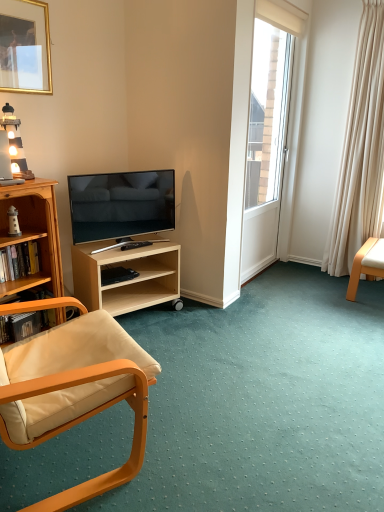
What do you see at coordinates (121, 204) in the screenshot? The height and width of the screenshot is (512, 384). I see `matte black tv at center left` at bounding box center [121, 204].

I want to click on white leather chair at right, which ranks as the second chair in front-to-back order, so click(x=366, y=265).

In order to face matte wood chair at left, which ranks as the 1th chair in left-to-right order, should I rotate leftwards or rightwards?

A 17.034 degree turn to the left will do.

What do you see at coordinates (75, 388) in the screenshot? I see `matte wood chair at left, the 2th chair in the back-to-front sequence` at bounding box center [75, 388].

You are a GUI agent. You are given a task and a screenshot of the screen. Output one action in this format:
    pyautogui.click(x=<x>, y=<y>)
    Task: Click on the matte black tv at center left
    Image resolution: width=384 pixels, height=512 pixels.
    Given the screenshot: What is the action you would take?
    pyautogui.click(x=121, y=204)

Image resolution: width=384 pixels, height=512 pixels. I want to click on the 1st shelf counting from the left of the black plastic remote control at lower center, so click(128, 280).

Relative to black plastic remote control at lower center, is light wood/finishedobject at center, the first shelf when ordered from right to left, in front or behind?

Clearly, light wood/finishedobject at center, the first shelf when ordered from right to left, is in front of black plastic remote control at lower center.

Does light wood/finishedobject at center, marked as the 2th shelf in a left-to-right arrangement, contain black plastic remote control at lower center?

Yes, black plastic remote control at lower center can be found within light wood/finishedobject at center, marked as the 2th shelf in a left-to-right arrangement.

Which object is thinner, light wood/finishedobject at center, marked as the 2th shelf in a left-to-right arrangement, or black plastic remote control at lower center?

black plastic remote control at lower center.

Is white glossy door at upper right at the right side of wooden bookshelf at left?

Yes, white glossy door at upper right is to the right of wooden bookshelf at left.

Consider the image. Which object is further away from the camera, white glossy door at upper right or wooden bookshelf at left?

white glossy door at upper right.

Between white glossy door at upper right and wooden bookshelf at left, which one has smaller size?

Smaller between the two is wooden bookshelf at left.

Measure the distance between white glossy door at upper right and wooden bookshelf at left.

They are 6.07 feet apart.

Does white leather chair at right, marked as the first chair in a right-to-left arrangement, have a greater height compared to wooden bookshelf at lower left, positioned as the 2th shelf in right-to-left order?

Yes.

From a real-world perspective, between white leather chair at right, marked as the first chair in a right-to-left arrangement, and wooden bookshelf at lower left, positioned as the 2th shelf in right-to-left order, who is vertically lower?

wooden bookshelf at lower left, positioned as the 2th shelf in right-to-left order, is physically lower.

Looking at this image, from the image's perspective, relative to wooden bookshelf at lower left, positioned as the 2th shelf in right-to-left order, is white leather chair at right, the second chair viewed from the left, above or below?

white leather chair at right, the second chair viewed from the left, is above wooden bookshelf at lower left, positioned as the 2th shelf in right-to-left order.

Is gold metallic picture frame at upper left further to camera compared to matte black tv at center left?

No.

Is gold metallic picture frame at upper left not inside matte black tv at center left?

Indeed, gold metallic picture frame at upper left is completely outside matte black tv at center left.

Considering the sizes of objects gold metallic picture frame at upper left and matte black tv at center left in the image provided, who is shorter, gold metallic picture frame at upper left or matte black tv at center left?

Standing shorter between the two is matte black tv at center left.

Is gold metallic picture frame at upper left oriented away from matte black tv at center left?

No.

Does gold metallic picture frame at upper left touch wooden bookshelf at lower left, positioned as the 2th shelf in right-to-left order?

gold metallic picture frame at upper left and wooden bookshelf at lower left, positioned as the 2th shelf in right-to-left order, are not in contact.

Do you think gold metallic picture frame at upper left is within wooden bookshelf at lower left, acting as the 1th shelf starting from the left, or outside of it?

gold metallic picture frame at upper left is not inside wooden bookshelf at lower left, acting as the 1th shelf starting from the left, it's outside.

Does gold metallic picture frame at upper left have a lesser width compared to wooden bookshelf at lower left, acting as the 1th shelf starting from the left?

Correct, the width of gold metallic picture frame at upper left is less than that of wooden bookshelf at lower left, acting as the 1th shelf starting from the left.

From the image's perspective, between hardcover book at left and gold metallic picture frame at upper left, who is located below?

hardcover book at left appears lower in the image.

Where is `book behind the gold metallic picture frame at upper left`? book behind the gold metallic picture frame at upper left is located at coordinates point(19,261).

Is gold metallic picture frame at upper left completely or partially inside hardcover book at left?

No.

Is matte wood chair at left, which ranks as the first chair in front-to-back order, in front of or behind wooden lighthouse at upper left in the image?

Clearly, matte wood chair at left, which ranks as the first chair in front-to-back order, is in front of wooden lighthouse at upper left.

Is point (142, 378) closer or farther from the camera than point (20, 176)?

Point (142, 378) is positioned closer to the camera compared to point (20, 176).

Can you tell me how much matte wood chair at left, which ranks as the 1th chair in left-to-right order, and wooden lighthouse at upper left differ in facing direction?

matte wood chair at left, which ranks as the 1th chair in left-to-right order, and wooden lighthouse at upper left are facing 72.4 degrees away from each other.

Is matte wood chair at left, which ranks as the 1th chair in left-to-right order, oriented towards wooden lighthouse at upper left?

No, matte wood chair at left, which ranks as the 1th chair in left-to-right order, does not turn towards wooden lighthouse at upper left.

The width and height of the screenshot is (384, 512). I want to click on the 1st shelf below when counting from the black plastic remote control at lower center (from the image's perspective), so click(128, 280).

Where is `screen door above the wooden bookshelf at left (from a real-world perspective)`? The width and height of the screenshot is (384, 512). screen door above the wooden bookshelf at left (from a real-world perspective) is located at coordinates (271, 129).

Based on their spatial positions, is hardcover book at left or gold metallic picture frame at upper left closer to black plastic remote control at lower center?

hardcover book at left.

Estimate the real-world distances between objects in this image. Which object is closer to light wood/finishedobject at center, marked as the 2th shelf in a left-to-right arrangement, wooden bookshelf at left or hardcover book at left?

Based on the image, wooden bookshelf at left appears to be nearer to light wood/finishedobject at center, marked as the 2th shelf in a left-to-right arrangement.

When comparing their distances from white glossy door at upper right, does light wood/finishedobject at center, marked as the 2th shelf in a left-to-right arrangement, or white leather chair at right, which ranks as the second chair in front-to-back order, seem further?

Among the two, light wood/finishedobject at center, marked as the 2th shelf in a left-to-right arrangement, is located further to white glossy door at upper right.

From the picture: Based on their spatial positions, is matte black tv at center left or white glossy door at upper right closer to hardcover book at left?

matte black tv at center left.

When comparing their distances from matte black tv at center left, does matte wood chair at left, the second chair in the right-to-left sequence, or wooden lighthouse at upper left seem further?

Based on the image, matte wood chair at left, the second chair in the right-to-left sequence, appears to be further to matte black tv at center left.

When comparing their distances from matte black tv at center left, does light wood/finishedobject at center, the first shelf when ordered from right to left, or wooden lighthouse at upper left seem closer?

light wood/finishedobject at center, the first shelf when ordered from right to left, lies closer to matte black tv at center left than the other object.

Which object lies nearer to the anchor point hardcover book at left, white leather chair at right, the second chair viewed from the left, or matte wood chair at left, which ranks as the first chair in front-to-back order?

The object closer to hardcover book at left is matte wood chair at left, which ranks as the first chair in front-to-back order.

When comparing their distances from wooden lighthouse at upper left, does white leather chair at right, which ranks as the second chair in front-to-back order, or light wood/finishedobject at center, the first shelf when ordered from right to left, seem closer?

light wood/finishedobject at center, the first shelf when ordered from right to left, is positioned closer to the anchor wooden lighthouse at upper left.

Where is `television between wooden bookshelf at lower left, acting as the 1th shelf starting from the left, and white leather chair at right, the second chair viewed from the left, from left to right`? television between wooden bookshelf at lower left, acting as the 1th shelf starting from the left, and white leather chair at right, the second chair viewed from the left, from left to right is located at coordinates (121, 204).

In order to click on screen door between matte wood chair at left, the 2th chair in the back-to-front sequence, and white leather chair at right, marked as the first chair in a right-to-left arrangement, along the z-axis in this screenshot , I will do `click(271, 129)`.

Find the location of a particular element. The width and height of the screenshot is (384, 512). shelf between wooden lighthouse at upper left and white leather chair at right, the second chair viewed from the left, in the horizontal direction is located at coordinates click(x=128, y=280).

Where is `book positioned between matte wood chair at left, the 2th chair in the back-to-front sequence, and white glossy door at upper right from near to far`? Image resolution: width=384 pixels, height=512 pixels. book positioned between matte wood chair at left, the 2th chair in the back-to-front sequence, and white glossy door at upper right from near to far is located at coordinates (19, 261).